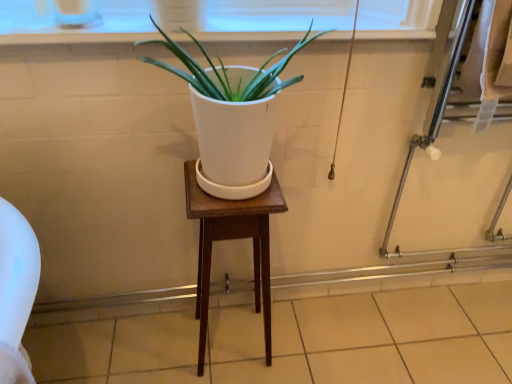
Where is `blank space above beige tile at lower center (from a real-world perspective)`? This screenshot has height=384, width=512. blank space above beige tile at lower center (from a real-world perspective) is located at coordinates (318, 341).